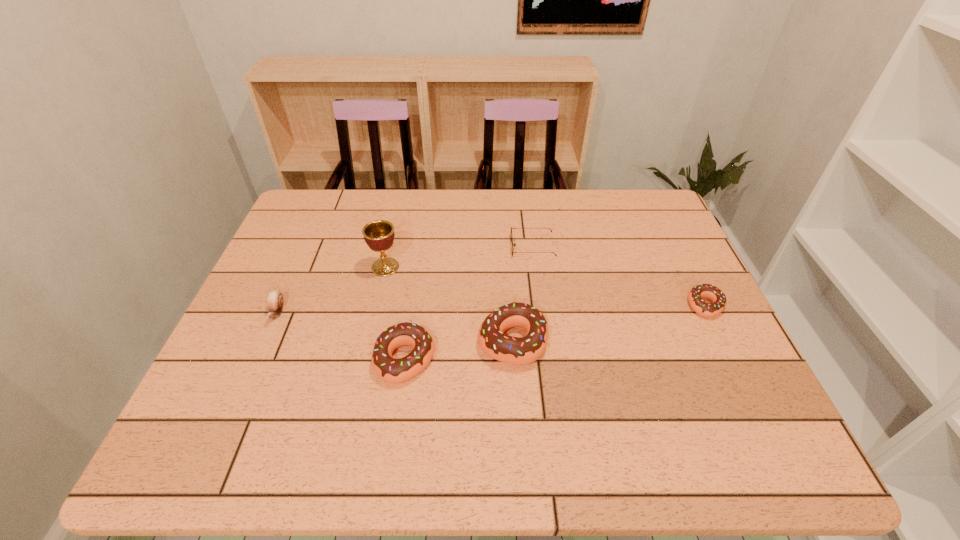
Identify the location of the second shortest doughnut. (391, 370).

You are a GUI agent. You are given a task and a screenshot of the screen. Output one action in this format:
    pyautogui.click(x=<x>, y=<y>)
    Task: Click on the second doughnut from left to right
    Image resolution: width=960 pixels, height=540 pixels.
    Given the screenshot: What is the action you would take?
    pyautogui.click(x=514, y=350)

This screenshot has width=960, height=540. Find the location of `the shortest doughnut`. the shortest doughnut is located at coordinates (711, 292).

Identify the location of the rightmost doughnut. This screenshot has width=960, height=540. (711, 292).

This screenshot has width=960, height=540. In order to click on sunglasses in this screenshot , I will do `click(512, 240)`.

This screenshot has height=540, width=960. I want to click on the tallest object, so click(379, 235).

At what (x,y) coordinates should I click in order to perform the action: click on escargot. Please return your answer as a coordinate pair (x, y). Looking at the image, I should click on (275, 299).

Identify the location of the fourth tallest object. (275, 299).

Locate an element on the screen. vacant space located on the left of the second shortest doughnut is located at coordinates (271, 360).

At what (x,y) coordinates should I click in order to perform the action: click on free region located 0.270m on the back of the second doughnut from right to left. Please return your answer as a coordinate pair (x, y). Looking at the image, I should click on (506, 245).